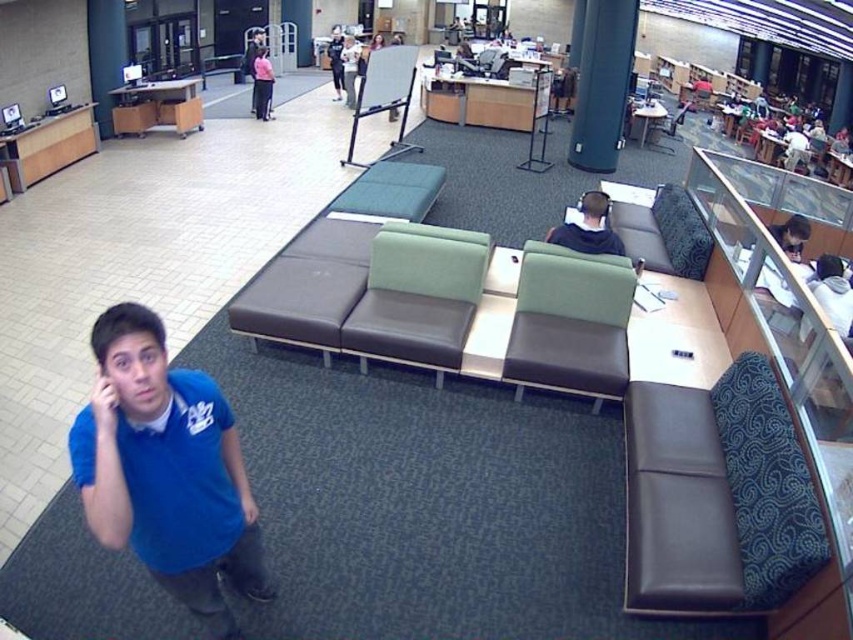
Question: Which is farther from the dark brown leather couch at lower right?

Choices:
 (A) green fabric pillar at upper center
 (B) dark blue shirt at center

Answer: (B)

Question: Which point is closer to the camera taking this photo?

Choices:
 (A) (787, 140)
 (B) (103, 394)
 (C) (583, 202)
 (D) (357, 106)

Answer: (B)

Question: Estimate the real-world distances between objects in this image. Which object is closer to the dark blue shirt at center?

Choices:
 (A) blue cotton shirt at lower left
 (B) dark brown leather couch at lower right

Answer: (B)

Question: Where is green leather chair at center located in relation to green leather couch at center in the image?

Choices:
 (A) above
 (B) below

Answer: (B)

Question: Can you confirm if green leather chair at center is positioned above matte black jacket at upper center?

Choices:
 (A) yes
 (B) no

Answer: (B)

Question: Is green leather chair at center to the right of dark blue shirt at center from the viewer's perspective?

Choices:
 (A) yes
 (B) no

Answer: (A)